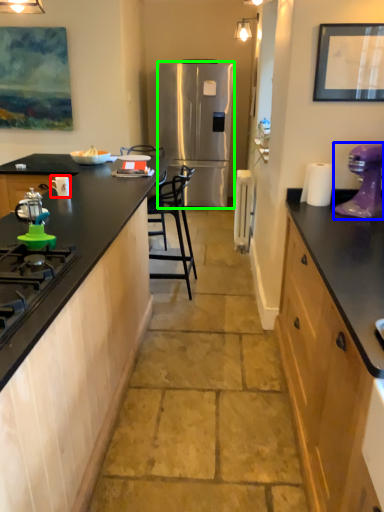
Question: Which object is the farthest from appliance (highlighted by a red box)? Choose among these: kitchen appliance (highlighted by a blue box) or refrigerator (highlighted by a green box).

Choices:
 (A) kitchen appliance
 (B) refrigerator

Answer: (B)